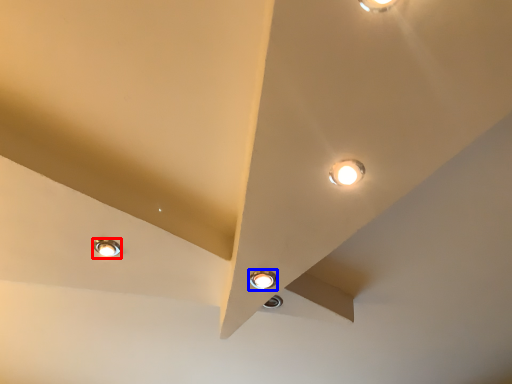
Question: Which point is closer to the camera, lamp (highlighted by a red box) or lamp (highlighted by a blue box)?

Choices:
 (A) lamp
 (B) lamp

Answer: (B)